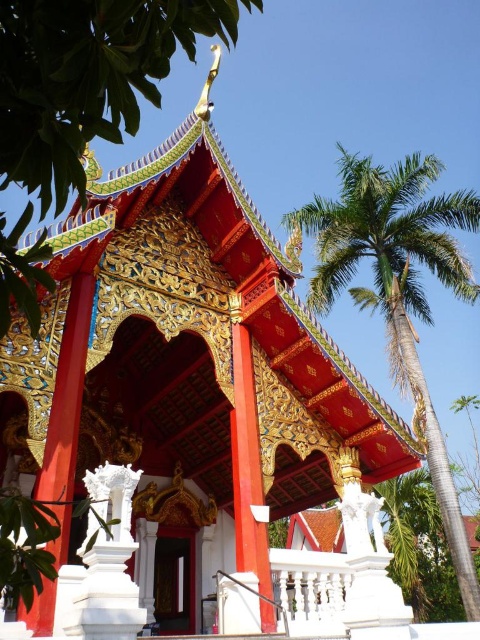
Question: Which object is farther from the camera taking this photo?

Choices:
 (A) green glossy tree at upper center
 (B) green leafy palm tree at upper right

Answer: (B)

Question: Is green glossy tree at upper center thinner than green leafy palm tree at upper right?

Choices:
 (A) no
 (B) yes

Answer: (B)

Question: Does green glossy tree at upper center appear on the right side of green leafy palm tree at upper right?

Choices:
 (A) yes
 (B) no

Answer: (B)

Question: Can you confirm if green glossy tree at upper center is bigger than green leafy palm tree at upper right?

Choices:
 (A) no
 (B) yes

Answer: (A)